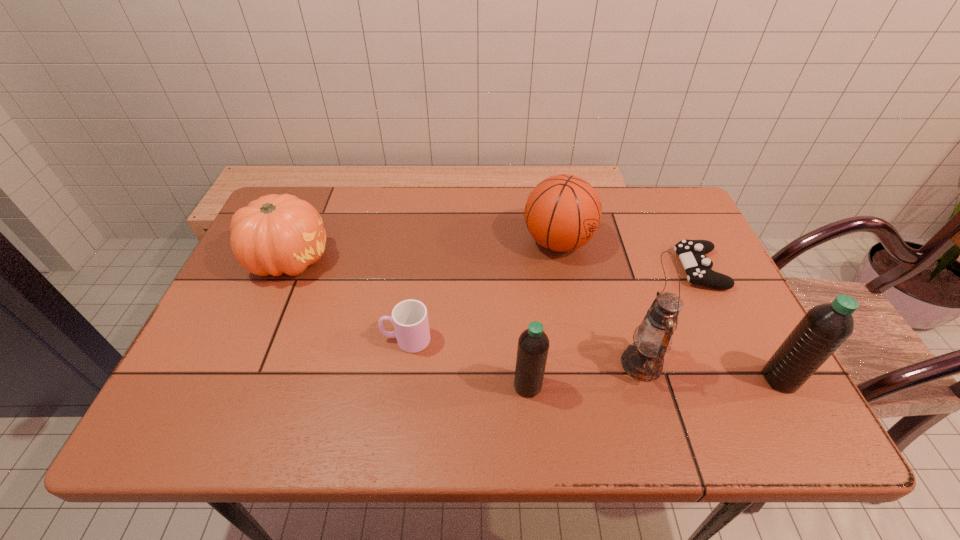
Identify the location of vacant area that lies between the sixth shortest object and the left water bottle. (654, 382).

You are a GUI agent. You are given a task and a screenshot of the screen. Output one action in this format:
    pyautogui.click(x=<x>, y=<y>)
    Task: Click on the object that is the fourth closest one to the tallest object
    The width and height of the screenshot is (960, 540).
    Given the screenshot: What is the action you would take?
    pyautogui.click(x=563, y=212)

The height and width of the screenshot is (540, 960). Find the location of `object that is the third closest to the control`. object that is the third closest to the control is located at coordinates (824, 328).

Where is `vacant point that satisfies the following two spatial constraints: 1. on the carved face of the leftmost object; 2. on the left side of the tallest object`? vacant point that satisfies the following two spatial constraints: 1. on the carved face of the leftmost object; 2. on the left side of the tallest object is located at coordinates (244, 364).

Locate an element on the screen. The image size is (960, 540). vacant region that satisfies the following two spatial constraints: 1. on the carved face of the pumpkin; 2. on the left side of the right water bottle is located at coordinates (238, 379).

Identify the location of free region that satisfies the following two spatial constraints: 1. on the front side of the basketball; 2. on the right side of the tallest object. (580, 364).

Image resolution: width=960 pixels, height=540 pixels. Find the location of `vacant space that satisfies the following two spatial constraints: 1. on the carved face of the leftmost object; 2. on the left side of the shorter water bottle`. vacant space that satisfies the following two spatial constraints: 1. on the carved face of the leftmost object; 2. on the left side of the shorter water bottle is located at coordinates point(234,386).

The image size is (960, 540). In order to click on free space that satisfies the following two spatial constraints: 1. on the carved face of the pumpkin; 2. on the left side of the oil lamp in this screenshot , I will do `click(244, 364)`.